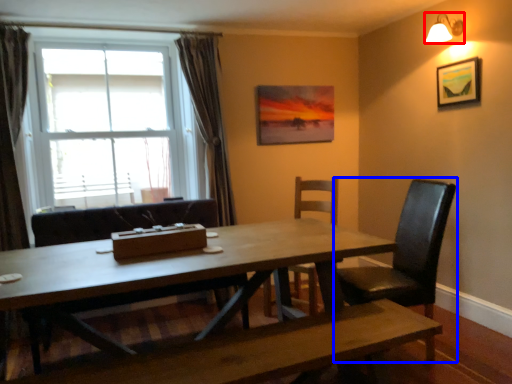
Question: Which point is further to the camera, lamp (highlighted by a red box) or chair (highlighted by a blue box)?

Choices:
 (A) lamp
 (B) chair

Answer: (A)